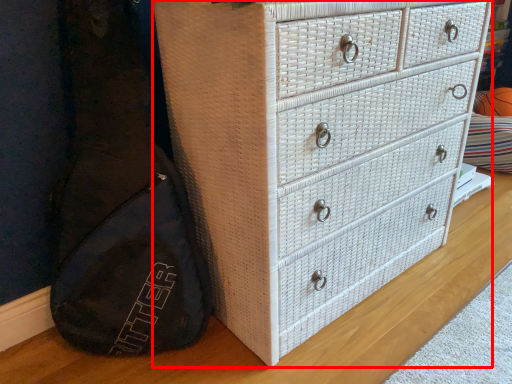
Question: Observing the image, what is the correct spatial positioning of chest of drawers (annotated by the red box) in reference to basketball?

Choices:
 (A) right
 (B) left

Answer: (B)